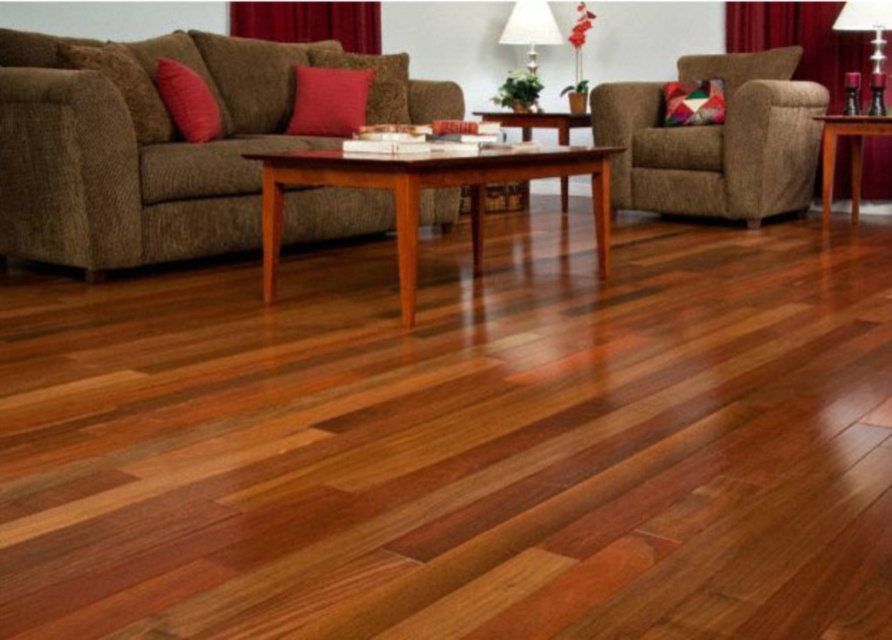
From the picture: You are standing at point (414, 256) and want to walk to the sofa. Is the point (746, 224) in your way?

Point (746, 224) is behind point (414, 256), so it is not in your path to the sofa.

You are standing at the origin point in the living room. The brown fabric couch at upper left is located at coordinates 0.228 in the x direction and 0.179 in the y direction. If you want to move towards the couch, which direction should you move in the x and y axes?

To move towards the brown fabric couch at upper left located at coordinates x 0.228 and y 0.179 from the origin, you should move in the positive x direction and positive y direction since both coordinates are positive relative to the origin.